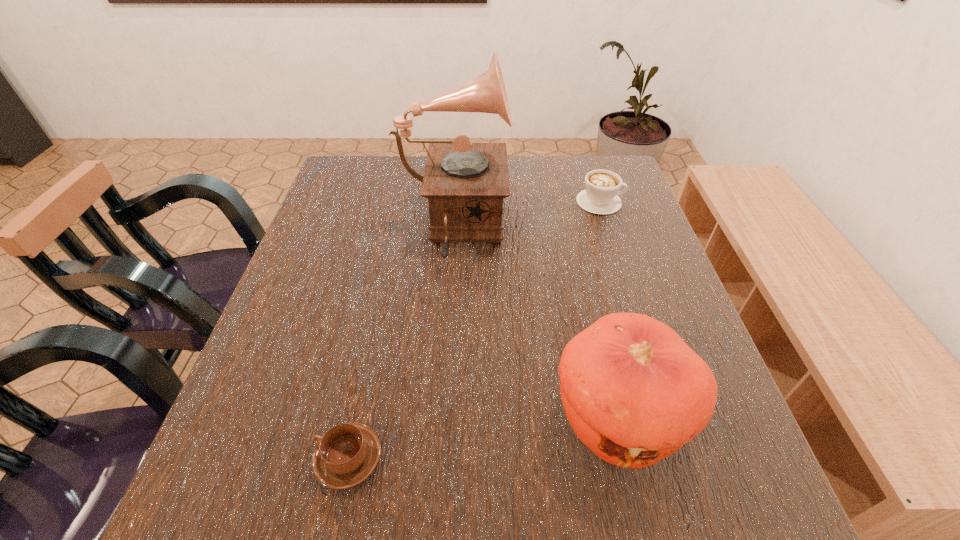
Find the location of a particular element. The image size is (960, 540). vacant space in between the pumpkin and the record player is located at coordinates (535, 323).

Identify the location of vacant point located between the nearer cappuccino and the pumpkin. This screenshot has height=540, width=960. (483, 437).

The width and height of the screenshot is (960, 540). I want to click on vacant space that's between the pumpkin and the left cappuccino, so click(x=483, y=437).

The image size is (960, 540). What are the coordinates of `free spot between the record player and the second tallest object` in the screenshot? It's located at (535, 323).

Where is `vacant area that lies between the record player and the pumpkin`? vacant area that lies between the record player and the pumpkin is located at coordinates (535, 323).

What are the coordinates of `free space between the pumpkin and the second shortest object` in the screenshot? It's located at (608, 309).

The image size is (960, 540). Identify the location of vacant space that is in between the farther cappuccino and the left cappuccino. (474, 330).

I want to click on the second closest object to the shortest object, so click(465, 183).

Choose which object is the nearest neighbor to the farther cappuccino. Please provide its 2D coordinates. Your answer should be formatted as a tuple, i.e. [(x, y)], where the tuple contains the x and y coordinates of a point satisfying the conditions above.

[(465, 183)]

Locate an element on the screen. The height and width of the screenshot is (540, 960). blank area in the image that satisfies the following two spatial constraints: 1. to the right of the right cappuccino's handle; 2. on the front side of the pumpkin is located at coordinates (669, 416).